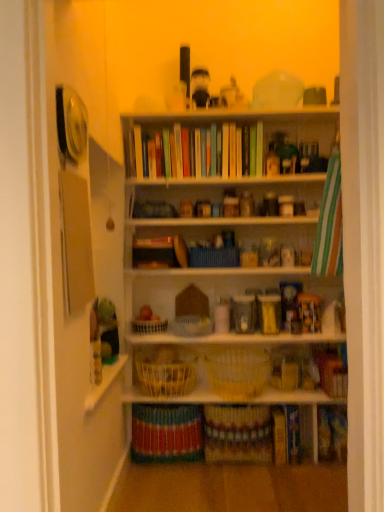
The image size is (384, 512). In order to click on free space in front of hardcover book at lower right, which is the 2th book in right-to-left order in this screenshot , I will do `click(302, 487)`.